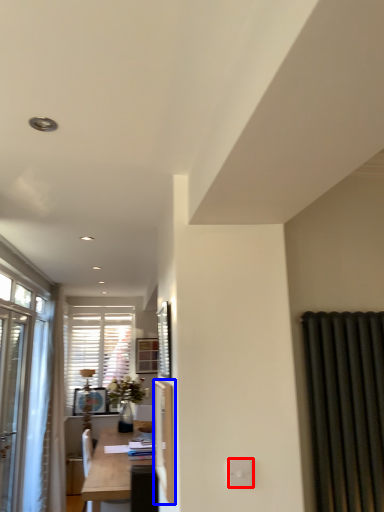
Question: Which point is closer to the camera, electric outlet (highlighted by a red box) or screen door (highlighted by a blue box)?

Choices:
 (A) electric outlet
 (B) screen door

Answer: (A)